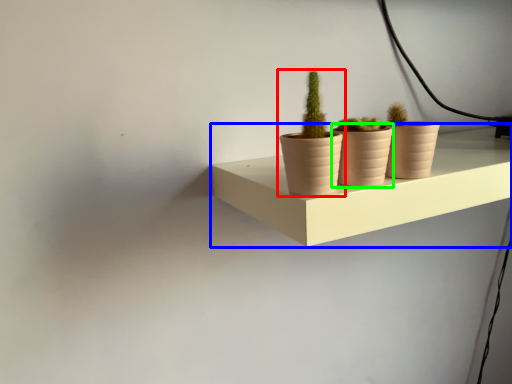
Question: Which is nearer to the houseplant (highlighted by a red box)? shelf (highlighted by a blue box) or flowerpot (highlighted by a green box).

Choices:
 (A) shelf
 (B) flowerpot

Answer: (B)